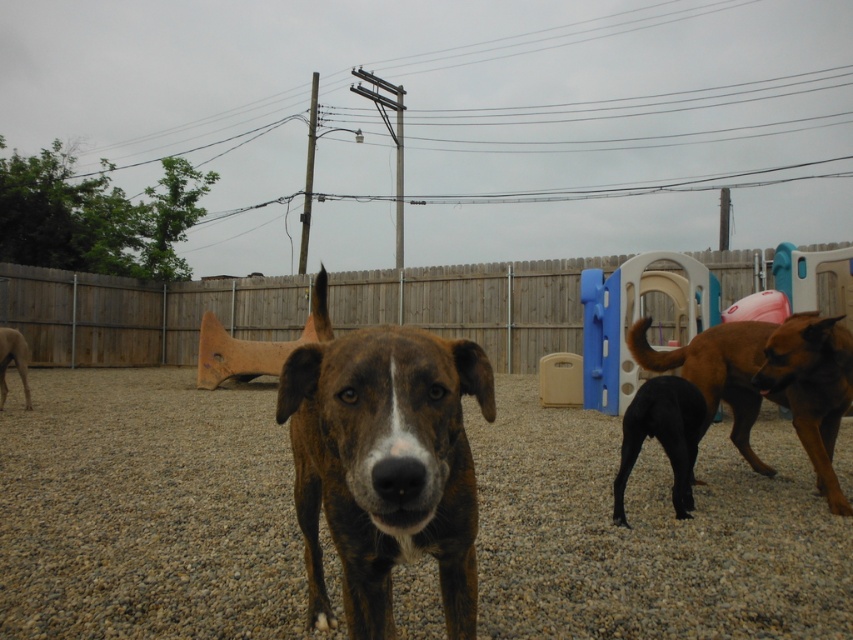
You are a dog owner trying to decide if your dog can fit through the gap between the wooden fence at center and the brown brindle dog at left. Can your dog pass through?

The wooden fence at center might be wider than brown brindle dog at left, so it is uncertain if your dog can pass through the gap. Check the actual width before attempting.